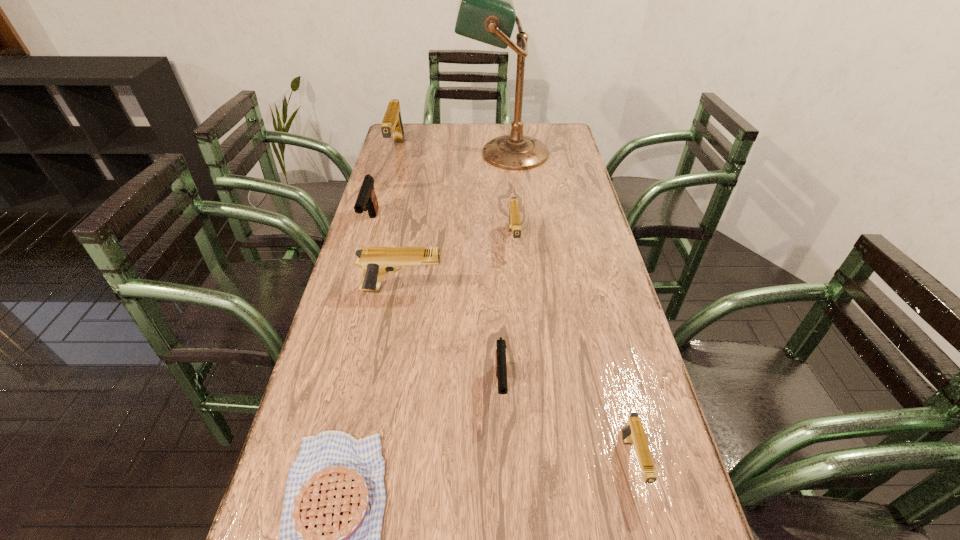
Locate an element on the screen. The height and width of the screenshot is (540, 960). the fourth pistol from left to right is located at coordinates tap(501, 368).

Locate an element on the screen. This screenshot has width=960, height=540. the second nearest pistol is located at coordinates pos(501,368).

At what (x,y) coordinates should I click in order to perform the action: click on the second shortest object. Please return your answer as a coordinate pair (x, y). Looking at the image, I should click on (633, 433).

Where is `the smallest tan pistol`? The width and height of the screenshot is (960, 540). the smallest tan pistol is located at coordinates (633, 433).

Find the location of a particular element. This screenshot has width=960, height=540. vacant area located 0.200m above the green lampshade of the tallest object is located at coordinates (410, 153).

The image size is (960, 540). I want to click on vacant space situated above the green lampshade of the tallest object, so click(x=390, y=153).

What are the coordinates of `free space located 0.070m above the green lampshade of the tallest object` in the screenshot? It's located at (444, 153).

Locate an element on the screen. The image size is (960, 540). free region located 0.050m at the barrel of the farthest pistol is located at coordinates (390, 176).

Where is `vacant space located at the barrel of the second biggest tan pistol`? vacant space located at the barrel of the second biggest tan pistol is located at coordinates (579, 289).

You are a GUI agent. You are given a task and a screenshot of the screen. Output one action in this format:
    pyautogui.click(x=<x>, y=<y>)
    Task: Click on the blank space located at the barrel of the left black pistol
    Image resolution: width=960 pixels, height=540 pixels.
    Given the screenshot: What is the action you would take?
    pyautogui.click(x=345, y=314)